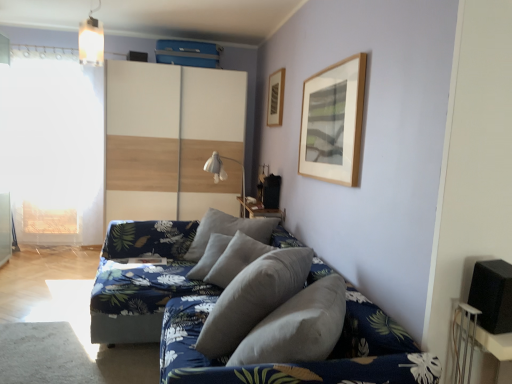
This screenshot has height=384, width=512. I want to click on vacant space underneath white matte window screen at left (from a real-world perspective), so click(x=56, y=249).